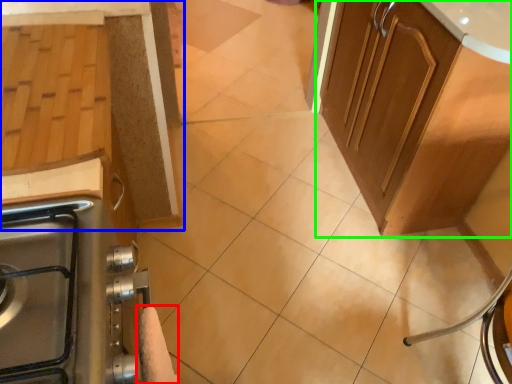
Question: Considering the real-world distances, which object is farthest from hand towel (highlighted by a red box)? cabinetry (highlighted by a blue box) or cabinetry (highlighted by a green box)?

Choices:
 (A) cabinetry
 (B) cabinetry

Answer: (B)